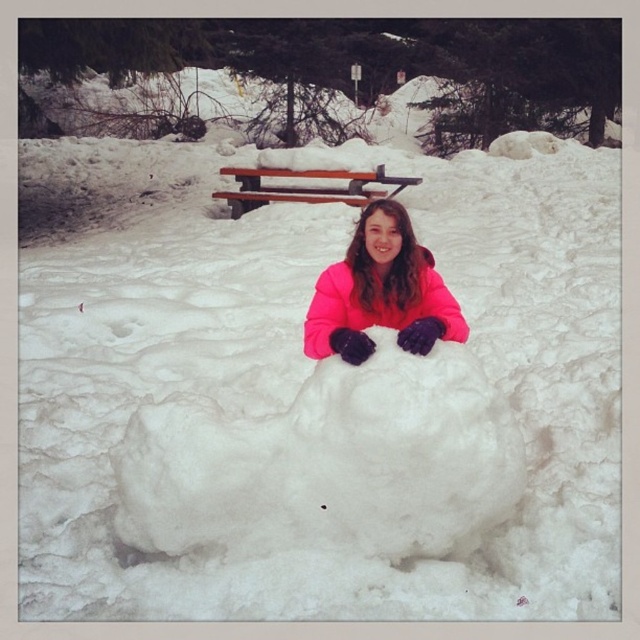
Between white fluffy snowball at center and pink fleece jacket at center, which one has less height?

pink fleece jacket at center

Does white fluffy snowball at center have a greater width compared to pink fleece jacket at center?

Indeed, white fluffy snowball at center has a greater width compared to pink fleece jacket at center.

Where is `white fluffy snowball at center`? Image resolution: width=640 pixels, height=640 pixels. white fluffy snowball at center is located at coordinates (330, 464).

I want to click on white fluffy snowball at center, so click(330, 464).

Who is positioned more to the left, white fluffy snowball at center or brown wooden bench at upper center?

From the viewer's perspective, brown wooden bench at upper center appears more on the left side.

Which is behind, point (515, 467) or point (248, 180)?

The point (248, 180) is behind.

Where is `white fluffy snowball at center`? white fluffy snowball at center is located at coordinates [330, 464].

Between pink fleece jacket at center and brown wooden bench at upper center, which one has more height?

With more height is brown wooden bench at upper center.

Can you confirm if pink fleece jacket at center is positioned to the left of brown wooden bench at upper center?

No, pink fleece jacket at center is not to the left of brown wooden bench at upper center.

Locate an element on the screen. pink fleece jacket at center is located at coordinates click(x=380, y=291).